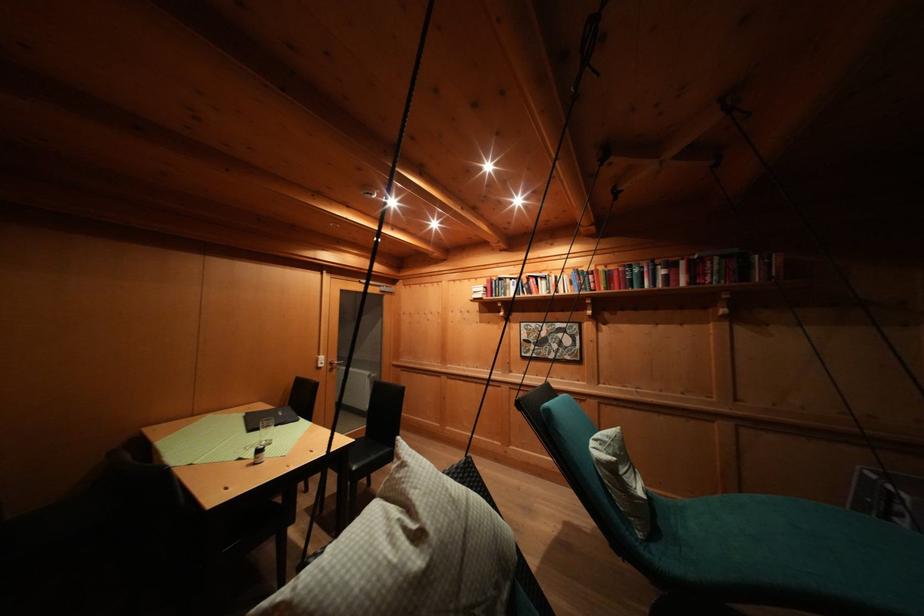
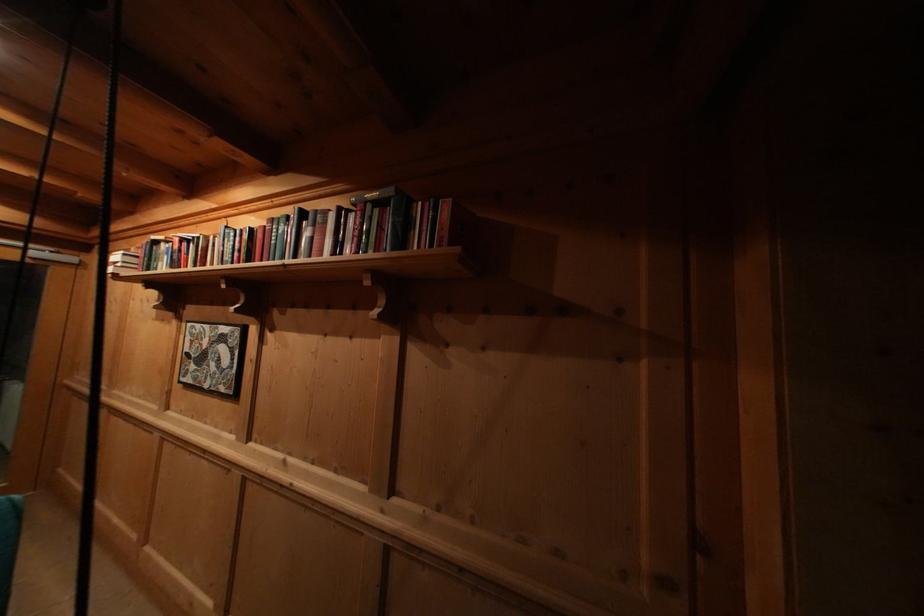
Where in the second image is the point corresponding to pixel 597 281 from the first image?

(244, 245)